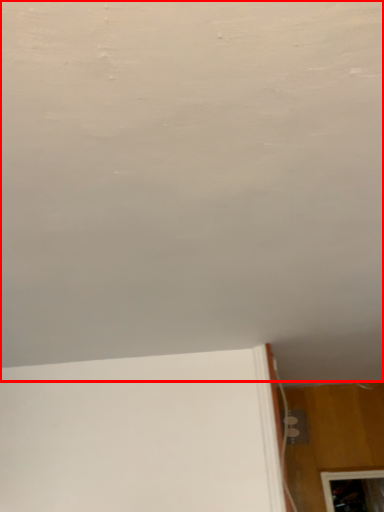
Question: From the image, what is the correct spatial relationship of backdrop (annotated by the red box) in relation to electric outlet?

Choices:
 (A) left
 (B) right

Answer: (A)